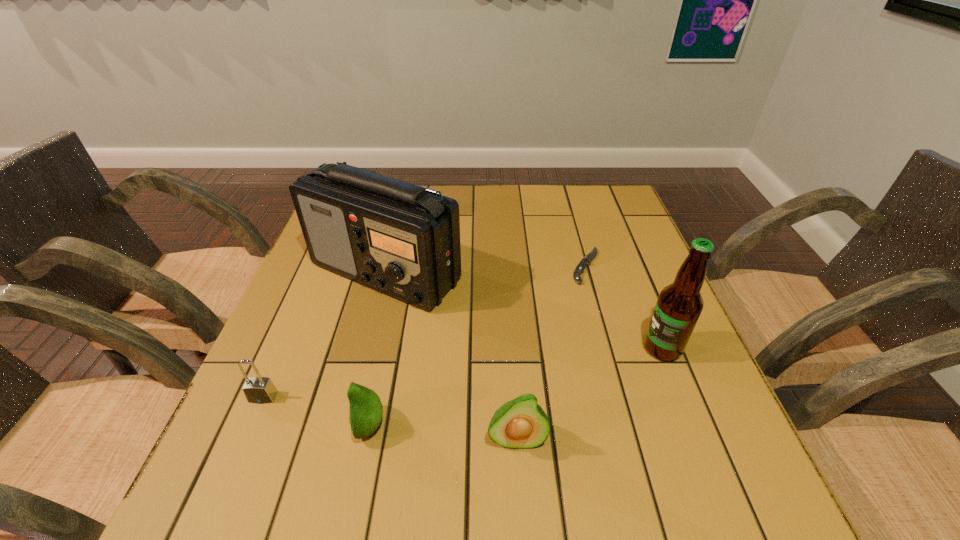
Find the location of a particular element. The width and height of the screenshot is (960, 540). vacant spot to place a avocado on the right is located at coordinates (670, 454).